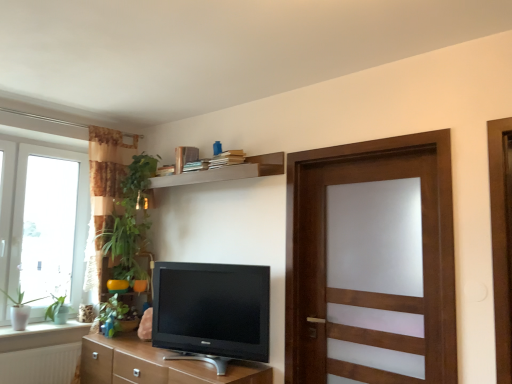
Question: Is wooden shelf at upper center turned away from white ceramic window sill at lower left?

Choices:
 (A) no
 (B) yes

Answer: (A)

Question: Considering the relative positions of wooden shelf at upper center and white ceramic window sill at lower left in the image provided, is wooden shelf at upper center to the right of white ceramic window sill at lower left from the viewer's perspective?

Choices:
 (A) no
 (B) yes

Answer: (B)

Question: Considering the relative sizes of wooden shelf at upper center and white ceramic window sill at lower left in the image provided, is wooden shelf at upper center bigger than white ceramic window sill at lower left?

Choices:
 (A) yes
 (B) no

Answer: (A)

Question: Does wooden shelf at upper center have a smaller size compared to white ceramic window sill at lower left?

Choices:
 (A) yes
 (B) no

Answer: (B)

Question: Could white ceramic window sill at lower left be considered to be inside wooden shelf at upper center?

Choices:
 (A) yes
 (B) no

Answer: (B)

Question: From a real-world perspective, is matte black tv at center physically located above or below white glass window at left?

Choices:
 (A) above
 (B) below

Answer: (B)

Question: Considering the positions of matte black tv at center and white glass window at left in the image, is matte black tv at center wider or thinner than white glass window at left?

Choices:
 (A) wide
 (B) thin

Answer: (B)

Question: Based on their positions, is matte black tv at center located to the left or right of white glass window at left?

Choices:
 (A) left
 (B) right

Answer: (B)

Question: Relative to white glass window at left, is matte black tv at center in front or behind?

Choices:
 (A) front
 (B) behind

Answer: (A)

Question: From the image's perspective, is green leafy plant at left, the third plant viewed from the left, positioned above or below white glass window at left?

Choices:
 (A) above
 (B) below

Answer: (B)

Question: From a real-world perspective, is green leafy plant at left, the third plant viewed from the left, positioned above or below white glass window at left?

Choices:
 (A) below
 (B) above

Answer: (A)

Question: Considering the positions of green leafy plant at left, arranged as the first plant when viewed from the right, and white glass window at left in the image, is green leafy plant at left, arranged as the first plant when viewed from the right, wider or thinner than white glass window at left?

Choices:
 (A) wide
 (B) thin

Answer: (A)

Question: Visually, is green leafy plant at left, arranged as the first plant when viewed from the right, positioned to the left or to the right of white glass window at left?

Choices:
 (A) right
 (B) left

Answer: (A)

Question: Is brown wood cabinet at lower center spatially inside wooden shelf at upper center, or outside of it?

Choices:
 (A) outside
 (B) inside

Answer: (A)

Question: Is point (230, 365) closer or farther from the camera than point (266, 155)?

Choices:
 (A) farther
 (B) closer

Answer: (B)